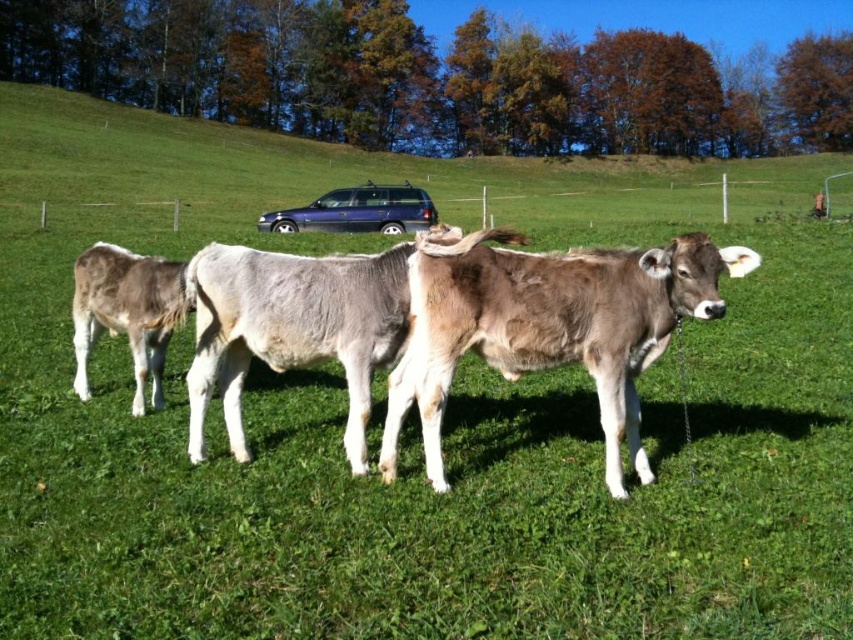
Question: Which of the following is the closest to the observer?

Choices:
 (A) (78, 284)
 (B) (447, 364)

Answer: (B)

Question: Which of the following is the closest to the observer?

Choices:
 (A) (192, 259)
 (B) (422, 189)

Answer: (A)

Question: Can you confirm if brown fuzzy cow at center is wider than brown matte cow at center?

Choices:
 (A) no
 (B) yes

Answer: (A)

Question: Observing the image, what is the correct spatial positioning of brown matte cow at center in reference to metallic blue suv at center?

Choices:
 (A) left
 (B) right

Answer: (B)

Question: Considering the relative positions of gray smooth calf at left and metallic blue suv at center in the image provided, where is gray smooth calf at left located with respect to metallic blue suv at center?

Choices:
 (A) below
 (B) above

Answer: (A)

Question: Which object appears farthest from the camera in this image?

Choices:
 (A) gray smooth calf at left
 (B) brown matte cow at center
 (C) brown fuzzy cow at center
 (D) metallic blue suv at center

Answer: (D)